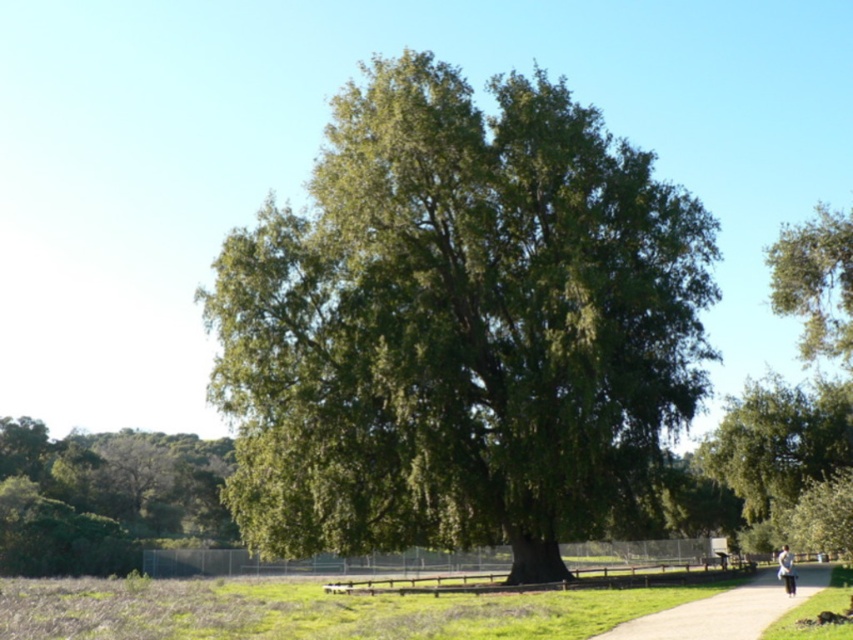
Is smooth concrete path at center wider than light blue jeans at lower right?

Yes.

Who is more forward, (666, 611) or (793, 577)?

Point (666, 611) is more forward.

Does point (811, 582) come closer to viewer compared to point (778, 572)?

No, (811, 582) is further to viewer.

In order to click on smooth concrete path at center in this screenshot , I will do click(726, 611).

Does green leafy tree at center have a smaller size compared to light blue jeans at lower right?

No.

Who is more forward, (575,205) or (778,566)?

Point (575,205) is in front.

What are the coordinates of `green leafy tree at center` in the screenshot? It's located at (460, 328).

The width and height of the screenshot is (853, 640). Describe the element at coordinates (460, 328) in the screenshot. I see `green leafy tree at center` at that location.

Who is positioned more to the left, green leafy tree at center or smooth concrete path at center?

From the viewer's perspective, green leafy tree at center appears more on the left side.

Is point (692, 394) behind point (798, 566)?

No, it is in front of (798, 566).

Image resolution: width=853 pixels, height=640 pixels. Find the location of `green leafy tree at center`. green leafy tree at center is located at coordinates (460, 328).